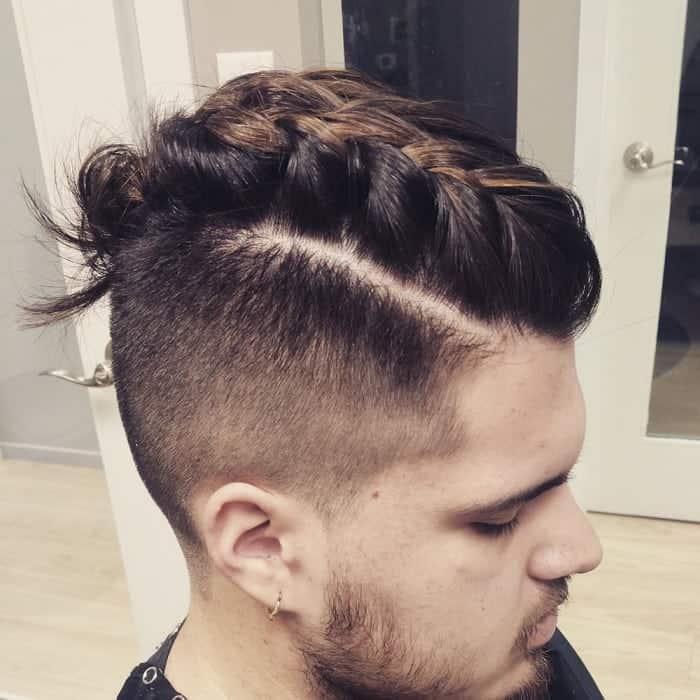
Image resolution: width=700 pixels, height=700 pixels. What are the coordinates of `floor` in the screenshot? It's located at (661, 568), (71, 580).